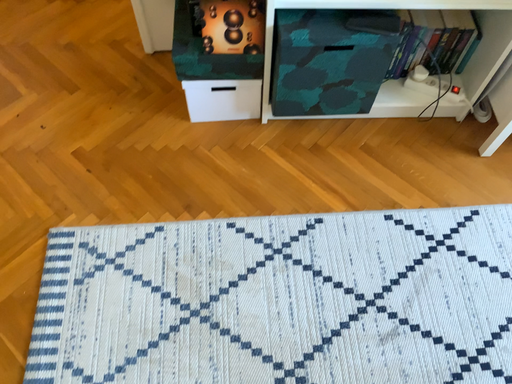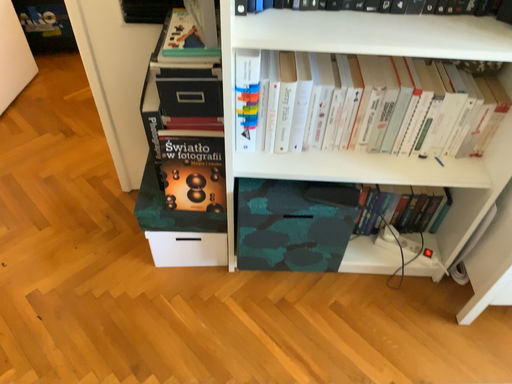
Question: How did the camera likely rotate when shooting the video?

Choices:
 (A) rotated upward
 (B) rotated downward

Answer: (A)